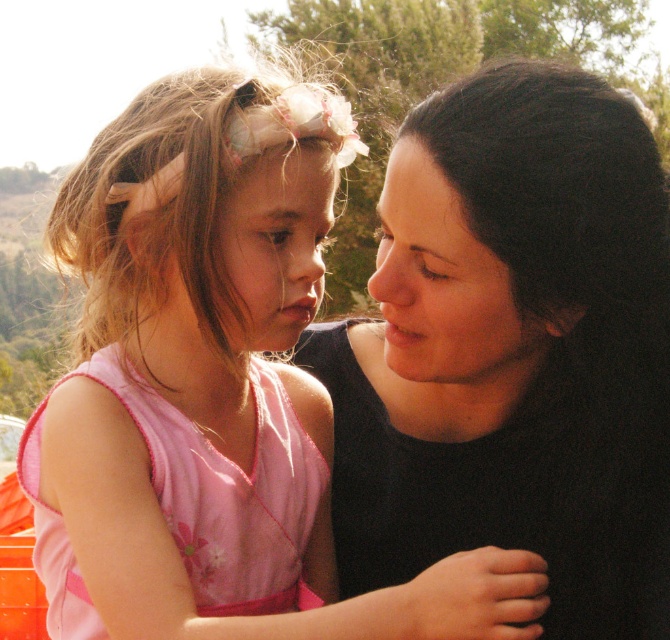
You are a photographer trying to capture a closeup of the pink satin dress at center and the black matte hair at upper right. Which object should you focus on first to ensure both are in focus?

The pink satin dress at center is closer to the viewer than the black matte hair at upper right, so focus on the pink satin dress at center first to ensure both are in focus.

You are a photographer setting up a photo shoot. You have a pink satin dress at center and a black matte hair at upper right in the scene. Which object occupies more horizontal space in the image?

The pink satin dress at center occupies more horizontal space than the black matte hair at upper right because its width is larger.